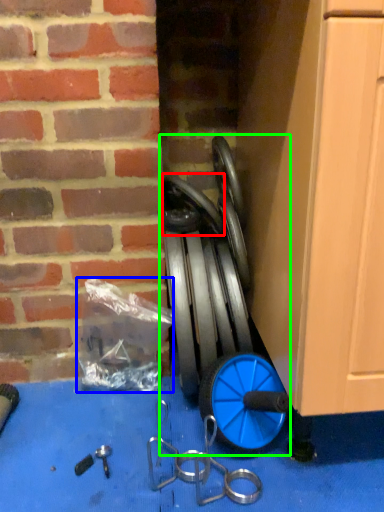
Question: Estimate the real-world distances between objects in this image. Which object is closer to wheel (highlighted by a red box), garbage (highlighted by a blue box) or garden hose (highlighted by a green box)?

Choices:
 (A) garbage
 (B) garden hose

Answer: (B)